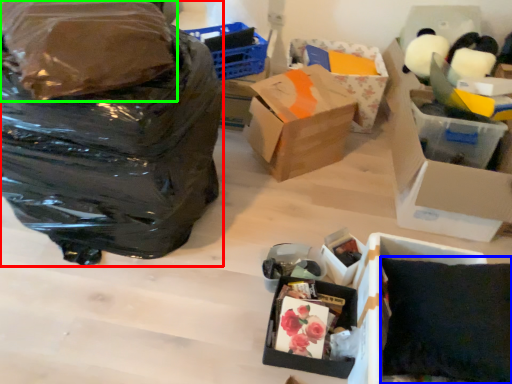
Question: Which object is positioned closest to bag (highlighted by a red box)? Select from pillow (highlighted by a blue box) and plastic bag (highlighted by a green box).

Choices:
 (A) pillow
 (B) plastic bag

Answer: (B)